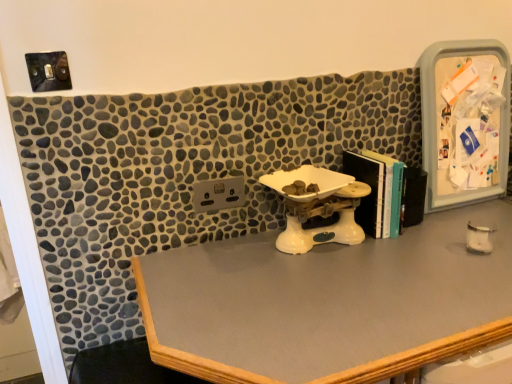
Locate an element on the screen. The height and width of the screenshot is (384, 512). vacant area that is in front of white plastic scale at center is located at coordinates (336, 288).